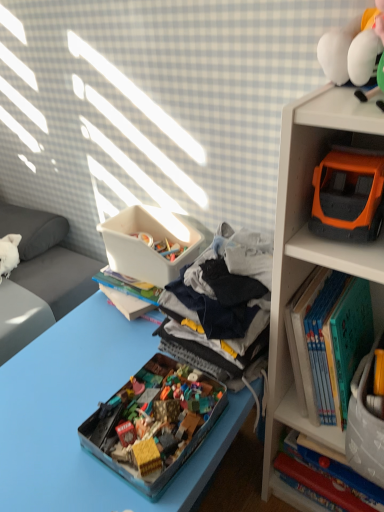
Describe the element at coordinates (316, 237) in the screenshot. I see `orange plastic toy truck at upper right` at that location.

What do you see at coordinates (329, 476) in the screenshot?
I see `hardcover book at right, placed as the second book when sorted from top to bottom` at bounding box center [329, 476].

This screenshot has width=384, height=512. What do you see at coordinates (154, 423) in the screenshot?
I see `translucent plastic toy box at center` at bounding box center [154, 423].

Measure the distance between hardcover book at upper right, the first book positioned from the top, and camera.

hardcover book at upper right, the first book positioned from the top, is 32.66 inches from camera.

Image resolution: width=384 pixels, height=512 pixels. Describe the element at coordinates (148, 246) in the screenshot. I see `white plastic container at center` at that location.

Locate an element on the screen. The height and width of the screenshot is (512, 384). white plastic container at center is located at coordinates (148, 246).

Where is `gray cotton clothes at center`? The height and width of the screenshot is (512, 384). gray cotton clothes at center is located at coordinates (223, 301).

Which of these two, hardcover book at upper right, the first book positioned from the top, or hardcover book at right, marked as the first book in a bottom-to-top arrangement, is wider?

hardcover book at upper right, the first book positioned from the top, is wider.

Based on their positions, is hardcover book at upper right, placed as the second book when sorted from bottom to top, located to the left or right of hardcover book at right, marked as the first book in a bottom-to-top arrangement?

In the image, hardcover book at upper right, placed as the second book when sorted from bottom to top, appears on the left side of hardcover book at right, marked as the first book in a bottom-to-top arrangement.

From the image's perspective, does hardcover book at upper right, placed as the second book when sorted from bottom to top, appear lower than hardcover book at right, marked as the first book in a bottom-to-top arrangement?

Incorrect, from the image's perspective, hardcover book at upper right, placed as the second book when sorted from bottom to top, is higher than hardcover book at right, marked as the first book in a bottom-to-top arrangement.

How much distance is there between hardcover book at upper right, the first book positioned from the top, and orange plastic toy truck at upper right?

A distance of 22.57 centimeters exists between hardcover book at upper right, the first book positioned from the top, and orange plastic toy truck at upper right.

Is hardcover book at upper right, placed as the second book when sorted from bottom to top, aimed at orange plastic toy truck at upper right?

No, hardcover book at upper right, placed as the second book when sorted from bottom to top, is not turned towards orange plastic toy truck at upper right.

Who is shorter, hardcover book at upper right, placed as the second book when sorted from bottom to top, or orange plastic toy truck at upper right?

Standing shorter between the two is orange plastic toy truck at upper right.

From the image's perspective, is hardcover book at upper right, placed as the second book when sorted from bottom to top, located above orange plastic toy truck at upper right?

No, from the image's perspective, hardcover book at upper right, placed as the second book when sorted from bottom to top, is not above orange plastic toy truck at upper right.

Is white plastic container at center thinner than blue plastic tray at center?

Indeed, white plastic container at center has a lesser width compared to blue plastic tray at center.

Based on the photo, from the image's perspective, is white plastic container at center positioned above or below blue plastic tray at center?

From the image's perspective, white plastic container at center appears above blue plastic tray at center.

In the scene shown: Considering the relative positions of white plastic container at center and blue plastic tray at center in the image provided, is white plastic container at center to the right of blue plastic tray at center from the viewer's perspective?

Yes.

Is white plastic container at center taller or shorter than blue plastic tray at center?

Considering their sizes, white plastic container at center has less height than blue plastic tray at center.

In terms of height, does translucent plastic toy box at center look taller or shorter compared to white plastic container at center?

translucent plastic toy box at center is shorter than white plastic container at center.

How distant is translucent plastic toy box at center from white plastic container at center?

translucent plastic toy box at center and white plastic container at center are 14.37 inches apart.

Which object is further away from the camera, translucent plastic toy box at center or white plastic container at center?

white plastic container at center is more distant.

Is translucent plastic toy box at center aimed at white plastic container at center?

No, translucent plastic toy box at center is not turned towards white plastic container at center.

Which of these two, hardcover book at right, placed as the second book when sorted from top to bottom, or translucent plastic toy box at center, is bigger?

Bigger between the two is hardcover book at right, placed as the second book when sorted from top to bottom.

Which point is more distant from viewer, (339,477) or (171,451)?

The point (339,477) is more distant.

Between hardcover book at right, placed as the second book when sorted from top to bottom, and translucent plastic toy box at center, which one is positioned behind?

hardcover book at right, placed as the second book when sorted from top to bottom, is further from the camera.

At what (x,y) coordinates should I click in order to perform the action: click on the 2nd book behind the translucent plastic toy box at center. Please return your answer as a coordinate pair (x, y). The width and height of the screenshot is (384, 512). Looking at the image, I should click on (329, 476).

Looking at this image, is gray cotton clothes at center far from blue plastic tray at center?

gray cotton clothes at center is actually quite close to blue plastic tray at center.

Is gray cotton clothes at center outside of blue plastic tray at center?

Yes.

Is the position of gray cotton clothes at center less distant than that of blue plastic tray at center?

No, gray cotton clothes at center is further to the viewer.

From a real-world perspective, is white plastic container at center under hardcover book at right, placed as the second book when sorted from top to bottom?

No.

Choose the correct answer: Is white plastic container at center inside hardcover book at right, marked as the first book in a bottom-to-top arrangement, or outside it?

white plastic container at center cannot be found inside hardcover book at right, marked as the first book in a bottom-to-top arrangement.

Is white plastic container at center oriented away from hardcover book at right, placed as the second book when sorted from top to bottom?

That's not correct — white plastic container at center is not looking away from hardcover book at right, placed as the second book when sorted from top to bottom.

Between white plastic container at center and hardcover book at right, marked as the first book in a bottom-to-top arrangement, which one has less height?

Standing shorter between the two is white plastic container at center.

The image size is (384, 512). Find the location of `book below the hardcover book at upper right, the first book positioned from the top (from the image's perspective)`. book below the hardcover book at upper right, the first book positioned from the top (from the image's perspective) is located at coordinates (329, 476).

The height and width of the screenshot is (512, 384). Find the location of `shelf above the hardcover book at upper right, placed as the second book when sorted from bottom to top (from a real-world perspective)`. shelf above the hardcover book at upper right, placed as the second book when sorted from bottom to top (from a real-world perspective) is located at coordinates (316, 237).

Considering their positions, is hardcover book at right, marked as the first book in a bottom-to-top arrangement, positioned further to gray cotton clothes at center than blue plastic tray at center?

hardcover book at right, marked as the first book in a bottom-to-top arrangement, is positioned further to the anchor gray cotton clothes at center.

Which object lies further to the anchor point orange plastic toy car at upper right, gray cotton clothes at center or translucent plastic toy box at center?

translucent plastic toy box at center.

When comparing their distances from gray cotton clothes at center, does orange plastic toy truck at upper right or white plastic container at center seem closer?

orange plastic toy truck at upper right.

Which object lies nearer to the anchor point hardcover book at right, placed as the second book when sorted from top to bottom, translucent plastic toy box at center or hardcover book at upper right, placed as the second book when sorted from bottom to top?

Based on the image, hardcover book at upper right, placed as the second book when sorted from bottom to top, appears to be nearer to hardcover book at right, placed as the second book when sorted from top to bottom.

Which object lies further to the anchor point orange plastic toy truck at upper right, orange plastic toy car at upper right or hardcover book at right, marked as the first book in a bottom-to-top arrangement?

hardcover book at right, marked as the first book in a bottom-to-top arrangement, is positioned further to the anchor orange plastic toy truck at upper right.

Which object lies nearer to the anchor point hardcover book at upper right, placed as the second book when sorted from bottom to top, translucent plastic toy box at center or hardcover book at right, marked as the first book in a bottom-to-top arrangement?

Based on the image, hardcover book at right, marked as the first book in a bottom-to-top arrangement, appears to be nearer to hardcover book at upper right, placed as the second book when sorted from bottom to top.

Which object lies nearer to the anchor point gray cotton clothes at center, blue plastic tray at center or orange plastic toy truck at upper right?

Based on the image, orange plastic toy truck at upper right appears to be nearer to gray cotton clothes at center.

When comparing their distances from gray cotton clothes at center, does hardcover book at upper right, the first book positioned from the top, or orange plastic toy truck at upper right seem closer?

hardcover book at upper right, the first book positioned from the top.

Image resolution: width=384 pixels, height=512 pixels. Identify the location of bookcase between gray cotton clothes at center and hardcover book at right, marked as the first book in a bottom-to-top arrangement, in the up-down direction. (312, 255).

Find the location of `clothing between orange plastic toy truck at upper right and blue plastic tray at center in the up-down direction`. clothing between orange plastic toy truck at upper right and blue plastic tray at center in the up-down direction is located at coordinates (223, 301).

This screenshot has width=384, height=512. In order to click on clothing between orange plastic toy truck at upper right and translucent plastic toy box at center from top to bottom in this screenshot , I will do `click(223, 301)`.

Where is `book between gray cotton clothes at center and hardcover book at right, placed as the second book when sorted from top to bottom, from top to bottom`? The height and width of the screenshot is (512, 384). book between gray cotton clothes at center and hardcover book at right, placed as the second book when sorted from top to bottom, from top to bottom is located at coordinates (331, 341).